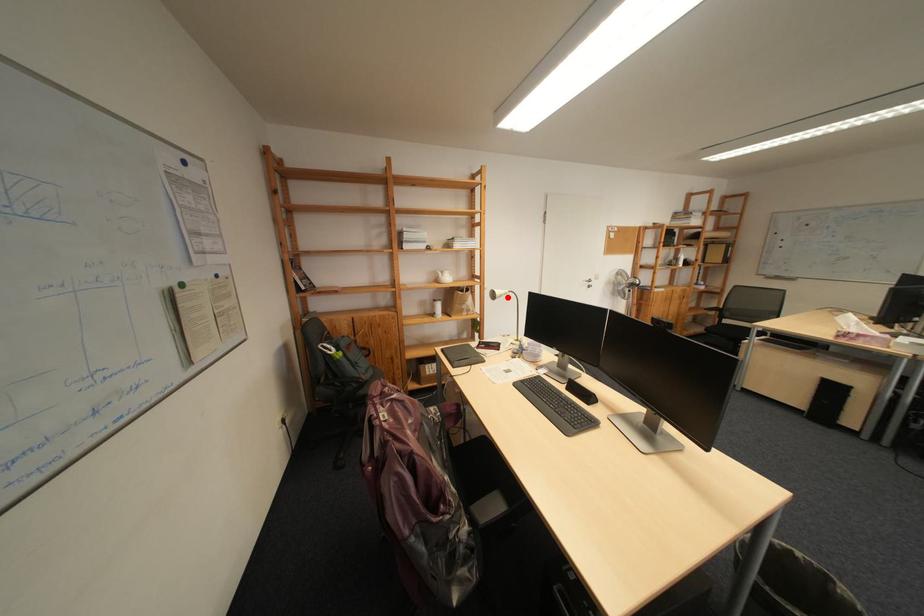
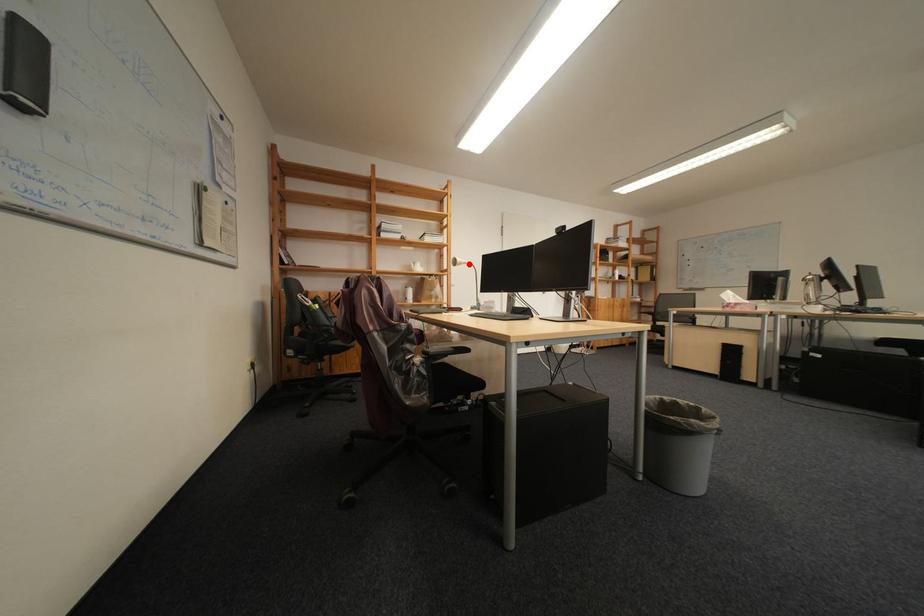
I am providing you with two images of the same scene from different viewpoints. A red point is marked on the first image and another point is marked on the second image. Does the point marked in image1 correspond to the same location as the one in image2?

Yes